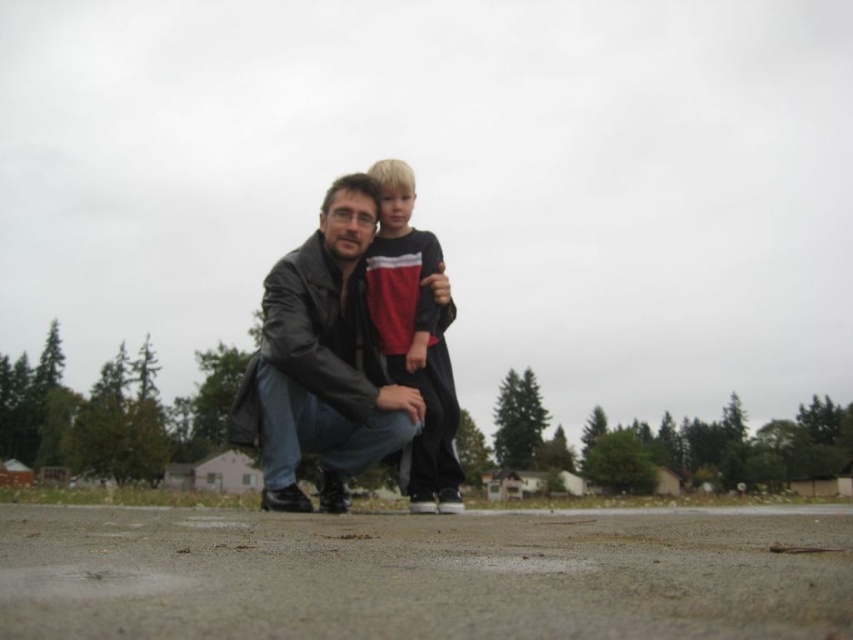
You are standing at the point marked at coordinates (322, 362) in the image. Looking around, you see the adult in a dark jacket and jeans crouching and the child in a red and black striped shirt. Which direction should you move to reach the adult?

The point marked at coordinates (322, 362) is on the leather jacket at center. Since the adult is wearing a dark jacket and crouching, you are already at the adult. No movement is needed.

You are a photographer setting up a shoot for two people wearing the leather jacket at center and the matte black shirt at center. You need to ensure that the clothing items are clearly visible in the photo. Which clothing item should you focus on first to ensure it stands out, considering their sizes?

The leather jacket at center is larger in size than the matte black shirt at center, so focusing on the leather jacket at center first will ensure it stands out more in the photo.

You are a photographer setting up a photo shoot for two people wearing a leather jacket at center and a matte black shirt at center. You need to position them so that the taller object is in the background to avoid blocking the shorter one. Which clothing item should be placed in the background?

The matte black shirt at center is taller than the leather jacket at center, so the matte black shirt at center should be placed in the background to avoid blocking the shorter leather jacket at center.